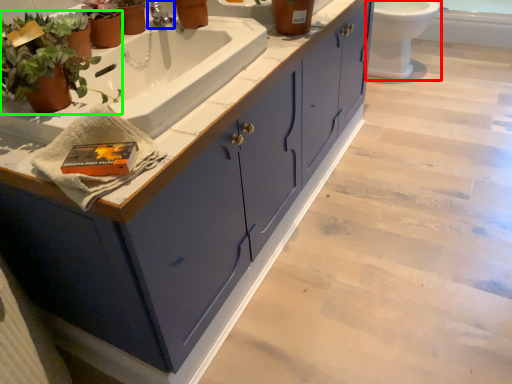
Question: Considering the real-world distances, which object is closest to toilet (highlighted by a red box)? tap (highlighted by a blue box) or houseplant (highlighted by a green box).

Choices:
 (A) tap
 (B) houseplant

Answer: (A)